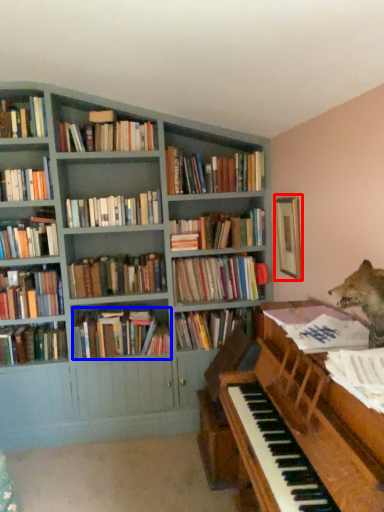
Question: Which of the following is the closest to the observer, picture frame (highlighted by a red box) or book (highlighted by a blue box)?

Choices:
 (A) picture frame
 (B) book

Answer: (A)